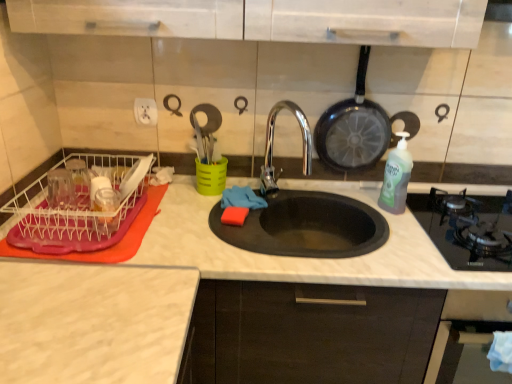
Question: From the image's perspective, relative to transparent plastic dish rack at left, is black non-stick frying pan at upper right above or below?

Choices:
 (A) above
 (B) below

Answer: (A)

Question: Considering the positions of black non-stick frying pan at upper right and transparent plastic dish rack at left in the image, is black non-stick frying pan at upper right taller or shorter than transparent plastic dish rack at left?

Choices:
 (A) tall
 (B) short

Answer: (A)

Question: Which is farther from the transparent plastic dish rack at left?

Choices:
 (A) black non-stick frying pan at upper right
 (B) white marble countertop at center
 (C) black glass oven at lower right
 (D) green translucent bottle at right
 (E) black glass gas stove at right

Answer: (E)

Question: Estimate the real-world distances between objects in this image. Which object is farther from the black glass oven at lower right?

Choices:
 (A) transparent plastic dish rack at left
 (B) black glass gas stove at right
 (C) green translucent bottle at right
 (D) black non-stick frying pan at upper right
 (E) white marble countertop at center

Answer: (A)